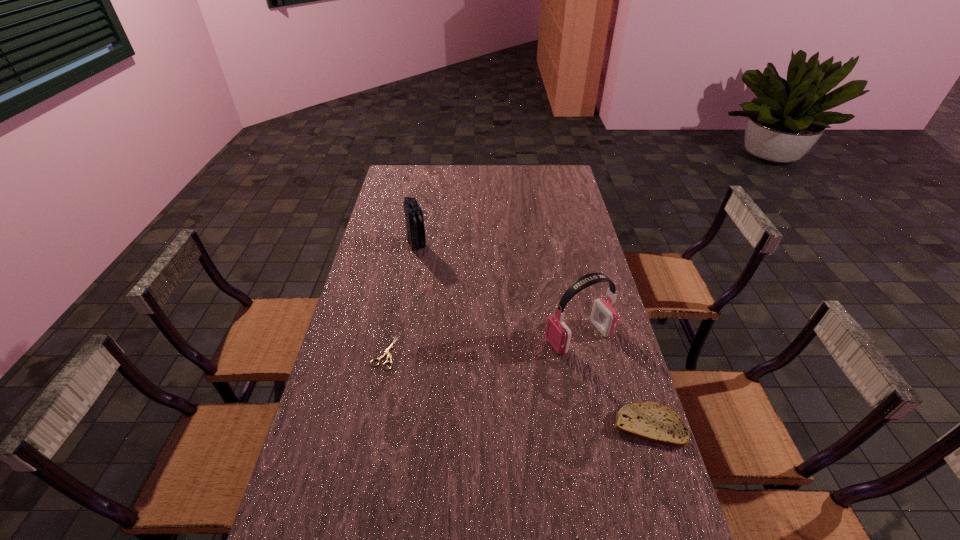
Find the location of `vacant spot on the desktop that is between the shortest object and the nearest object and is positioned with the zip open on the third shortest object`. vacant spot on the desktop that is between the shortest object and the nearest object and is positioned with the zip open on the third shortest object is located at coordinates (488, 381).

Image resolution: width=960 pixels, height=540 pixels. What are the coordinates of `vacant spot on the desktop that is between the shortest object and the third tallest object and is positioned on the outer surface of the tallest object` in the screenshot? It's located at (473, 377).